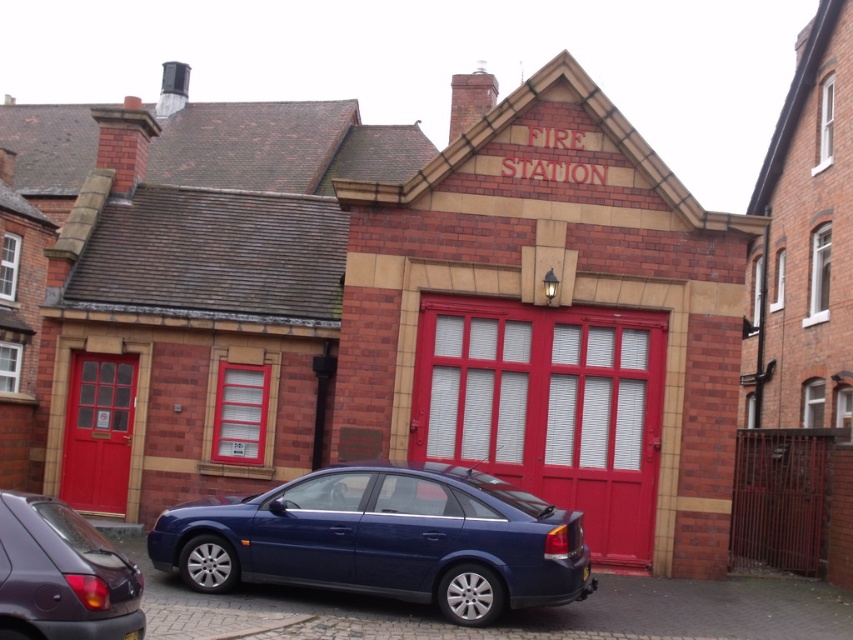
You are a delivery person arriving at the fire station and need to park your vehicle. Your van is 2 meters wide. The smooth glossy red garage door at center and the matte purple car at lower left are in front of you. Can your van fit through the space between them?

The smooth glossy red garage door at center is wider than the matte purple car at lower left. Since the garage door is wider, the space between them may be sufficient for your 2m van. However, without exact measurements, it is uncertain. Check the distance between them before proceeding.

You are a delivery driver who needs to park your truck in front of the fire station. You see the smooth glossy red garage door at center and the matte purple car at lower left. Which object is higher in the image?

The smooth glossy red garage door at center is located above the matte purple car at lower left, so it is higher in the image.

You are a delivery person who needs to park your truck, which is 2 meters wide, between the glossy blue sedan at center and the matte red door at left. Can your truck fit in the space between them?

The glossy blue sedan at center is larger than the matte red door at left, but the exact distance between them isn